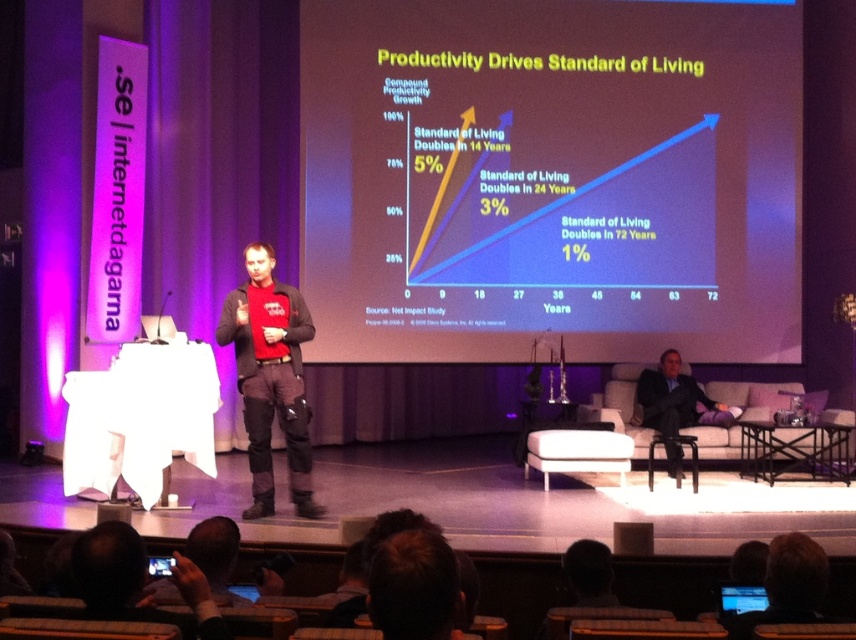
Question: From the image, what is the correct spatial relationship of white matte projector screen at upper center in relation to matte red shirt at center?

Choices:
 (A) right
 (B) left

Answer: (A)

Question: Which is farther from the white matte projector screen at upper center?

Choices:
 (A) matte black screen at lower right
 (B) matte red shirt at center
 (C) dark suit at right

Answer: (A)

Question: Does white matte projector screen at upper center have a greater width compared to matte black screen at lower right?

Choices:
 (A) no
 (B) yes

Answer: (B)

Question: Does dark suit at right appear on the right side of matte black screen at lower right?

Choices:
 (A) no
 (B) yes

Answer: (B)

Question: Which point appears closest to the camera in this image?

Choices:
 (A) (720, 588)
 (B) (706, 134)

Answer: (A)

Question: Considering the real-world distances, which object is closest to the matte red shirt at center?

Choices:
 (A) white matte projector screen at upper center
 (B) dark suit at right
 (C) matte black screen at lower right

Answer: (C)